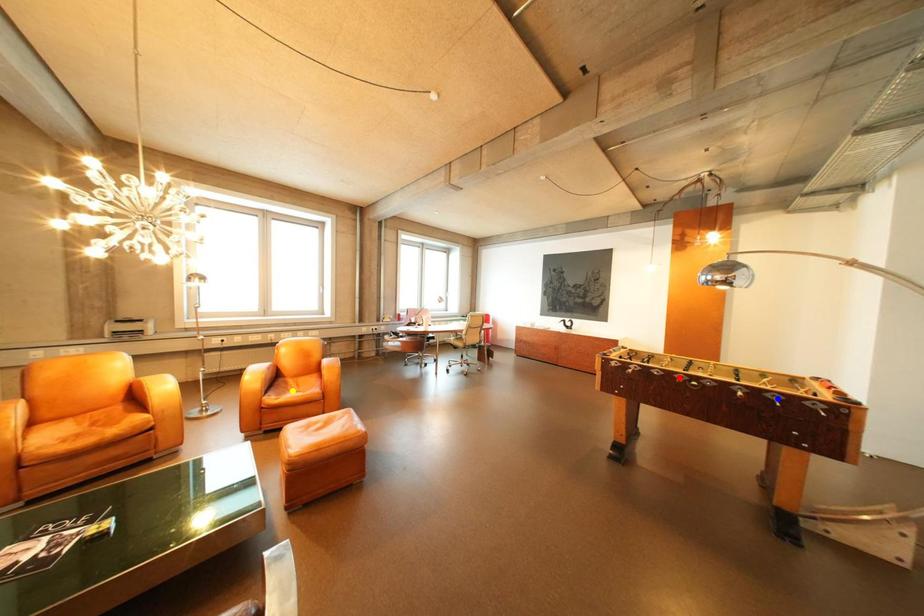
Order these from farthest to nearest:
A) red point
B) yellow point
C) blue point

yellow point → red point → blue point